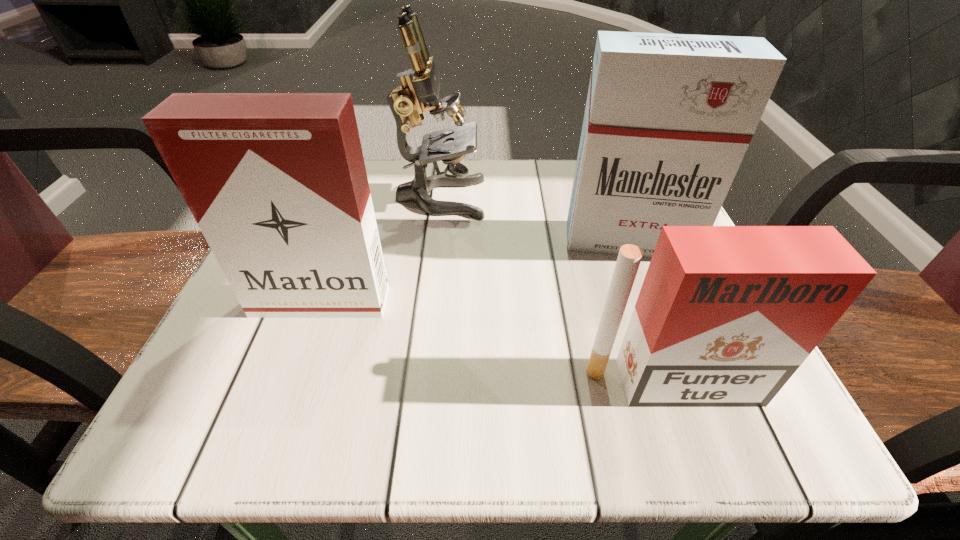
Where is `the farthest object`? The height and width of the screenshot is (540, 960). the farthest object is located at coordinates (419, 85).

Locate an element on the screen. This screenshot has height=540, width=960. the farthest cigarette case is located at coordinates (668, 119).

In order to click on the second nearest cigarette case in this screenshot , I will do `click(277, 183)`.

Find the location of a particular element. This screenshot has width=960, height=540. the leftmost cigarette case is located at coordinates (277, 183).

You are a GUI agent. You are given a task and a screenshot of the screen. Output one action in this format:
    pyautogui.click(x=<x>, y=<y>)
    Task: Click on the shortest cigarette case
    This screenshot has height=540, width=960.
    Given the screenshot: What is the action you would take?
    pyautogui.click(x=725, y=316)

Where is `the nearest object`? the nearest object is located at coordinates (725, 316).

This screenshot has height=540, width=960. In order to click on vacant space located at the eyepieces of the microscope in this screenshot , I will do `click(569, 198)`.

Locate an element on the screen. vacant space situated on the back of the farthest cigarette case is located at coordinates (612, 195).

Identify the location of free spot located 0.190m on the front-facing side of the second farthest cigarette case. The image size is (960, 540). click(275, 432).

Locate an element on the screen. The image size is (960, 540). object located in the far edge section of the desktop is located at coordinates (419, 85).